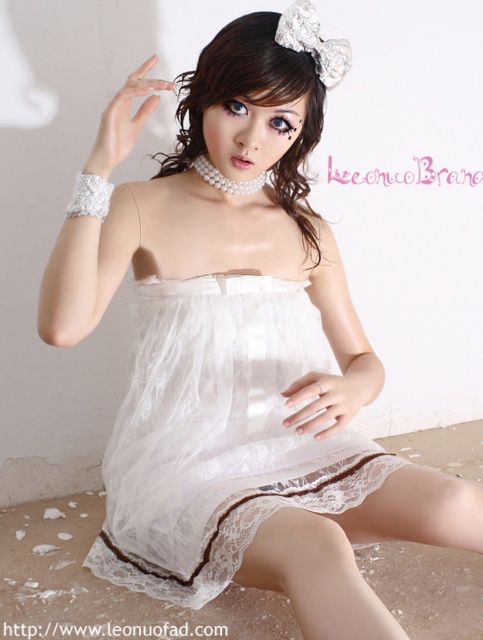
Is white lace dress at center smaller than pearl/glossy bracelet at upper left?

Actually, white lace dress at center might be larger than pearl/glossy bracelet at upper left.

Does white lace dress at center lie behind pearl/glossy bracelet at upper left?

Yes, it is behind pearl/glossy bracelet at upper left.

Who is more distant from viewer, [151,352] or [138,96]?

The point [151,352] is behind.

This screenshot has width=483, height=640. Identify the location of white lace dress at center. (218, 435).

Can you confirm if brown shiny hair at upper center is shorter than white matte nails at center?

No.

Find the location of `brown shiny hair at upper center`. brown shiny hair at upper center is located at coordinates (255, 104).

Who is more distant from viewer, (278, 58) or (137, 83)?

The point (278, 58) is more distant.

Find the location of a particular element. brown shiny hair at upper center is located at coordinates (255, 104).

At what (x,y) coordinates should I click in order to perform the action: click on brown shiny hair at upper center. Please return your answer as a coordinate pair (x, y). This screenshot has width=483, height=640. Looking at the image, I should click on 255,104.